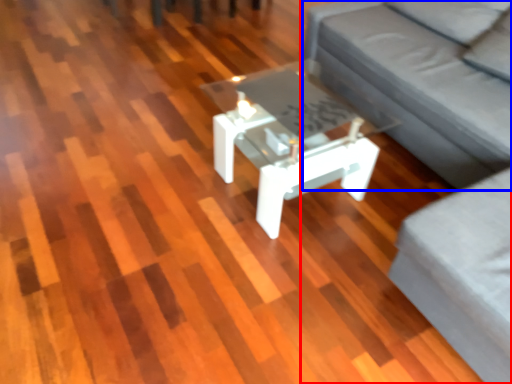
Question: Which object is further to the camera taking this photo, studio couch (highlighted by a red box) or couch (highlighted by a blue box)?

Choices:
 (A) studio couch
 (B) couch

Answer: (B)